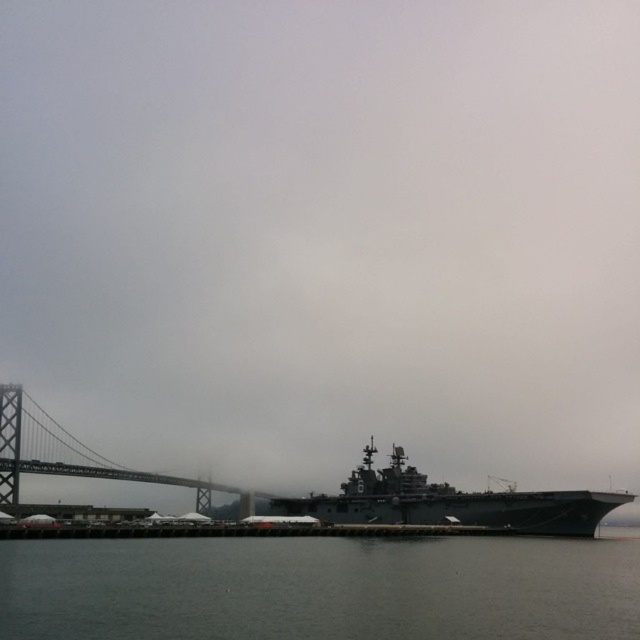
You are standing at the waterfront and see two points marked in the image. The first point is at coordinates point [568,500] and the second is at point [250,513]. Which of these two points is closer to your current position?

Point [568,500] is closer to the camera than point [250,513], so the first point is closer to your current position.

From the picture: You are a photographer standing on the deck of the naval ship docked at the waterfront. You want to capture a photo that includes both the dark gray water at lower center and the gray metallic bridge at left. Which object should be placed closer to the bottom of the frame to ensure both are visible?

The dark gray water at lower center should be placed closer to the bottom of the frame since it is shorter than the gray metallic bridge at left, allowing both to fit within the photo.